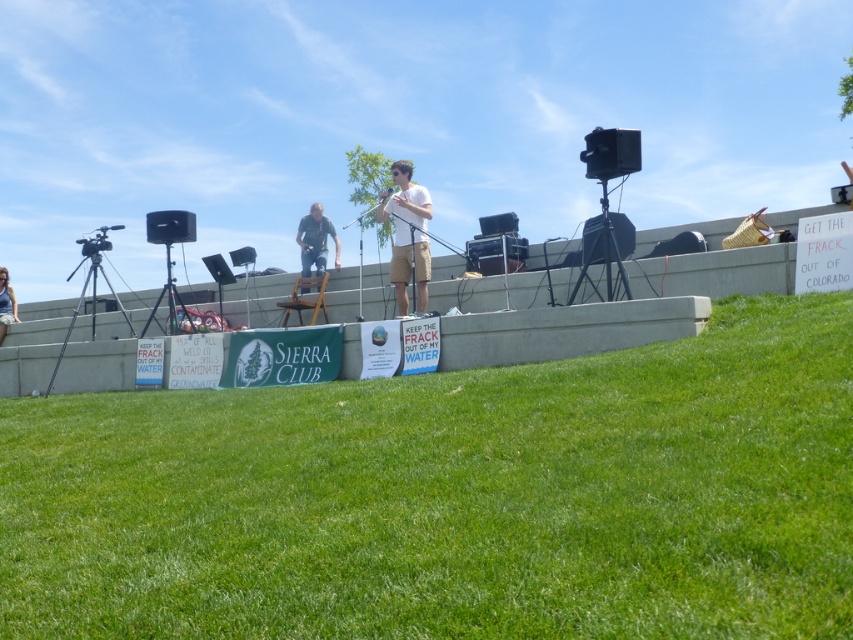
Question: Which object is the closest to the black matte tripod at right?

Choices:
 (A) black metal tripod at left
 (B) denim jacket at lower left

Answer: (A)

Question: Among these points, which one is nearest to the camera?

Choices:
 (A) (0, 340)
 (B) (608, 292)
 (C) (51, 380)

Answer: (B)

Question: Estimate the real-world distances between objects in this image. Which object is closer to the denim jacket at center?

Choices:
 (A) black matte tripod at left
 (B) denim jacket at lower left
 (C) black metal tripod at left

Answer: (A)

Question: Does black matte tripod at right have a smaller size compared to black metal tripod at left?

Choices:
 (A) yes
 (B) no

Answer: (A)

Question: Is black matte tripod at right thinner than black matte tripod at left?

Choices:
 (A) yes
 (B) no

Answer: (B)

Question: Is black matte tripod at left thinner than denim jacket at lower left?

Choices:
 (A) yes
 (B) no

Answer: (A)